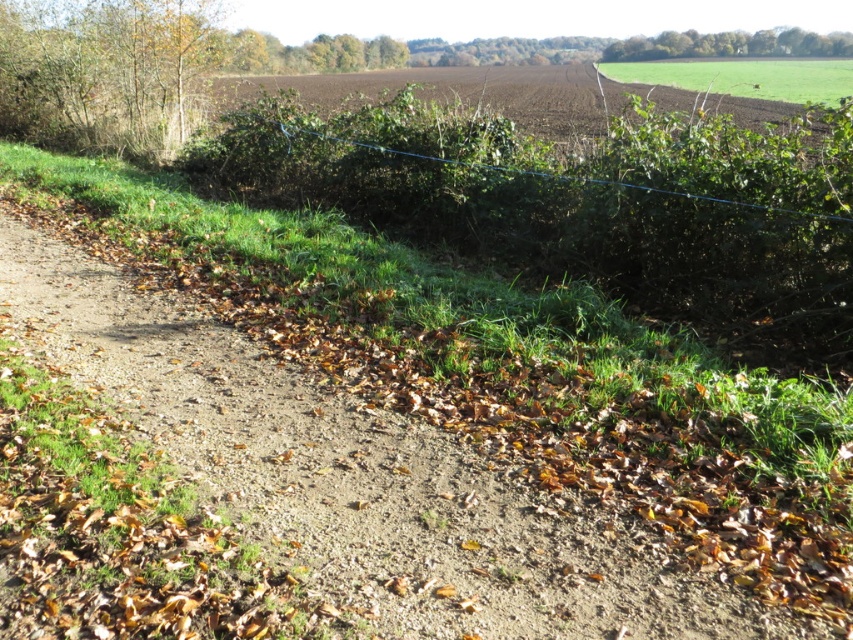
Question: Does brown gravel trail at lower left appear over green grassy field at upper right?

Choices:
 (A) no
 (B) yes

Answer: (A)

Question: Considering the relative positions of brown gravel trail at lower left and green grassy field at upper right in the image provided, where is brown gravel trail at lower left located with respect to green grassy field at upper right?

Choices:
 (A) below
 (B) above

Answer: (A)

Question: Where is brown gravel trail at lower left located in relation to green grassy field at upper right in the image?

Choices:
 (A) right
 (B) left

Answer: (B)

Question: Among these objects, which one is nearest to the camera?

Choices:
 (A) green grassy field at upper right
 (B) brown gravel trail at lower left

Answer: (B)

Question: Which point is closer to the camera taking this photo?

Choices:
 (A) (727, 68)
 (B) (567, 509)

Answer: (B)